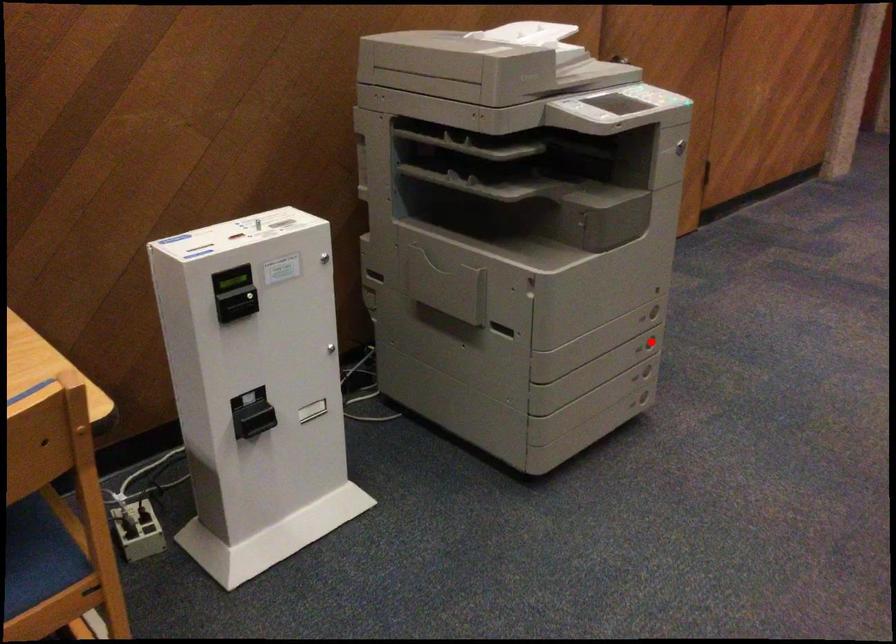
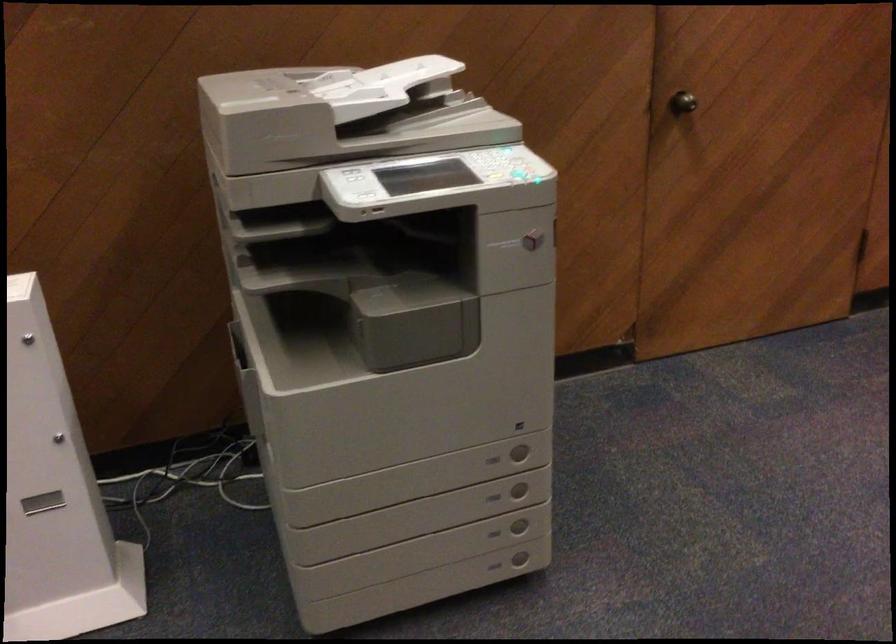
The point at the highlighted location is marked in the first image. Where is the corresponding point in the second image?

(519, 489)